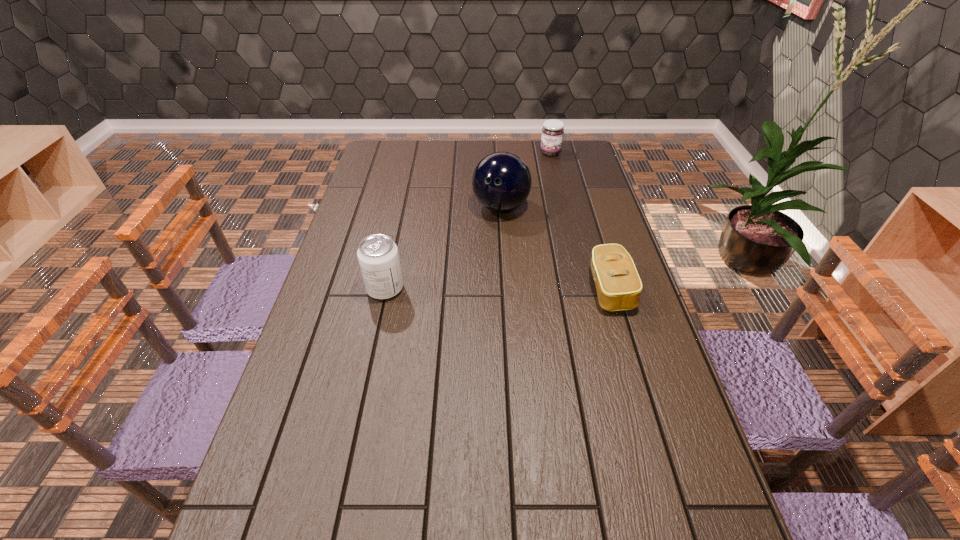
You are a GUI agent. You are given a task and a screenshot of the screen. Output one action in this format:
    pyautogui.click(x=<x>, y=<y>)
    Task: Click on the vacant spot on the desktop that is between the soda can and the shortest object and is positioned on the front label of the farthest object
    Image resolution: width=960 pixels, height=540 pixels.
    Given the screenshot: What is the action you would take?
    [513, 289]

At what (x,y) coordinates should I click in order to perform the action: click on vacant spot on the desktop that is between the leftmost object and the shortest object and is positioned on the side of the bowling ball with the finger holes. Please return your answer as a coordinate pair (x, y). The height and width of the screenshot is (540, 960). Looking at the image, I should click on (475, 289).